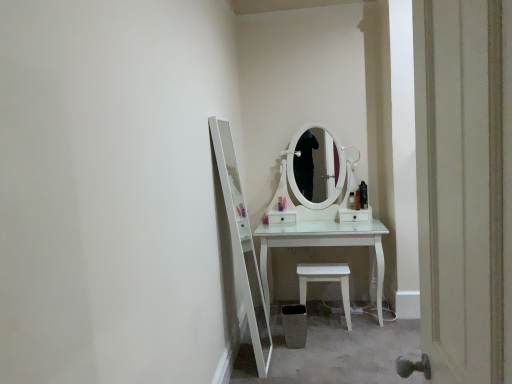
This screenshot has width=512, height=384. I want to click on translucent plastic bottle at center, the second toiletry from the left, so (284, 203).

What do you see at coordinates (326, 281) in the screenshot? This screenshot has width=512, height=384. I see `white plastic stool at lower center` at bounding box center [326, 281].

You are a GUI agent. You are given a task and a screenshot of the screen. Output one action in this format:
    pyautogui.click(x=<x>, y=<y>)
    Task: Click on the translucent plastic bottle at center, the second toiletry from the left
    Image resolution: width=512 pixels, height=384 pixels.
    Given the screenshot: What is the action you would take?
    pyautogui.click(x=284, y=203)

From a real-world perspective, is white wooden door at right above or below matte plastic container at center, placed as the 1th toiletry when sorted from left to right?

white wooden door at right is situated higher than matte plastic container at center, placed as the 1th toiletry when sorted from left to right, in the real world.

Is white wooden door at right not near matte plastic container at center, placed as the 1th toiletry when sorted from left to right?

white wooden door at right is positioned a significant distance from matte plastic container at center, placed as the 1th toiletry when sorted from left to right.

Considering the sizes of objects white wooden door at right and matte plastic container at center, placed as the 1th toiletry when sorted from left to right, in the image provided, who is shorter, white wooden door at right or matte plastic container at center, placed as the 1th toiletry when sorted from left to right,?

With less height is matte plastic container at center, placed as the 1th toiletry when sorted from left to right.

Considering the positions of objects matte black hairbrush at center, which is counted as the 3th toiletry, starting from the left, and translucent plastic bottle at center, the second toiletry from the left, in the image provided, who is behind, matte black hairbrush at center, which is counted as the 3th toiletry, starting from the left, or translucent plastic bottle at center, the second toiletry from the left,?

translucent plastic bottle at center, the second toiletry from the left, is further from the camera.

Between matte black hairbrush at center, positioned as the third toiletry in right-to-left order, and translucent plastic bottle at center, the second toiletry from the left, which one has larger width?

translucent plastic bottle at center, the second toiletry from the left, is wider.

How different are the orientations of matte black hairbrush at center, which is counted as the 3th toiletry, starting from the left, and translucent plastic bottle at center, which is counted as the 4th toiletry, starting from the right, in degrees?

matte black hairbrush at center, which is counted as the 3th toiletry, starting from the left, and translucent plastic bottle at center, which is counted as the 4th toiletry, starting from the right, are facing 0.00201 degrees away from each other.

Find the location of a particular element. This screenshot has height=384, width=512. toiletry that is the 1st one when counting backward from the matte black hairbrush at center, positioned as the third toiletry in right-to-left order is located at coordinates (284, 203).

You are a GUI agent. You are given a task and a screenshot of the screen. Output one action in this format:
    pyautogui.click(x=<x>, y=<y>)
    Task: Click on the toiletry that is the 2nd one when counting forward from the matte black hairbrush at center, positioned as the third toiletry in right-to-left order
    This screenshot has height=384, width=512.
    Given the screenshot: What is the action you would take?
    pyautogui.click(x=357, y=199)

Is matte black hairbrush at center, positioned as the third toiletry in right-to-left order, with matte orange bottle at center, the 2th toiletry viewed from the right?

Yes, matte black hairbrush at center, positioned as the third toiletry in right-to-left order, and matte orange bottle at center, the 2th toiletry viewed from the right, clearly make contact.

Is matte black hairbrush at center, positioned as the third toiletry in right-to-left order, oriented away from matte orange bottle at center, which is the 4th toiletry from left to right?

matte black hairbrush at center, positioned as the third toiletry in right-to-left order, does not have its back to matte orange bottle at center, which is the 4th toiletry from left to right.

Looking at this image, from their relative heights in the image, would you say matte black hairbrush at center, positioned as the third toiletry in right-to-left order, is taller or shorter than matte orange bottle at center, the 2th toiletry viewed from the right?

In the image, matte black hairbrush at center, positioned as the third toiletry in right-to-left order, appears to be shorter than matte orange bottle at center, the 2th toiletry viewed from the right.

Considering the positions of objects translucent plastic bottle at center, the second toiletry from the left, and white wooden door at right in the image provided, who is more to the right, translucent plastic bottle at center, the second toiletry from the left, or white wooden door at right?

white wooden door at right is more to the right.

How many degrees apart are the facing directions of translucent plastic bottle at center, the second toiletry from the left, and white wooden door at right?

The facing directions of translucent plastic bottle at center, the second toiletry from the left, and white wooden door at right are 90.9 degrees apart.

Who is smaller, translucent plastic bottle at center, the second toiletry from the left, or white wooden door at right?

translucent plastic bottle at center, the second toiletry from the left.

From a real-world perspective, does translucent plastic bottle at center, which is counted as the 4th toiletry, starting from the right, sit lower than matte black hairbrush at center, which is counted as the 3th toiletry, starting from the left?

Yes.

Is translucent plastic bottle at center, the second toiletry from the left, not near matte black hairbrush at center, which is counted as the 3th toiletry, starting from the left?

No.

Considering the sizes of objects translucent plastic bottle at center, the second toiletry from the left, and matte black hairbrush at center, positioned as the third toiletry in right-to-left order, in the image provided, who is thinner, translucent plastic bottle at center, the second toiletry from the left, or matte black hairbrush at center, positioned as the third toiletry in right-to-left order,?

matte black hairbrush at center, positioned as the third toiletry in right-to-left order.

Does translucent plastic bottle at center, the second toiletry from the left, come in front of matte black hairbrush at center, which is counted as the 3th toiletry, starting from the left?

That is False.

Where is `the 1st toiletry counting from the right side of the white wooden door at right`? This screenshot has width=512, height=384. the 1st toiletry counting from the right side of the white wooden door at right is located at coordinates (352, 201).

Consider the image. Would you consider white wooden door at right to be distant from matte black hairbrush at center, positioned as the third toiletry in right-to-left order?

That's right, there is a large distance between white wooden door at right and matte black hairbrush at center, positioned as the third toiletry in right-to-left order.

Based on the photo, does white wooden door at right appear on the left side of matte black hairbrush at center, positioned as the third toiletry in right-to-left order?

Indeed, white wooden door at right is positioned on the left side of matte black hairbrush at center, positioned as the third toiletry in right-to-left order.

Is matte orange bottle at center, the 2th toiletry viewed from the right, directly adjacent to translucent plastic spray bottle at right, positioned as the first toiletry in right-to-left order?

Yes, matte orange bottle at center, the 2th toiletry viewed from the right, and translucent plastic spray bottle at right, positioned as the first toiletry in right-to-left order, clearly make contact.

Relative to translucent plastic spray bottle at right, acting as the fifth toiletry starting from the left, is matte orange bottle at center, which is the 4th toiletry from left to right, in front or behind?

In the image, matte orange bottle at center, which is the 4th toiletry from left to right, appears in front of translucent plastic spray bottle at right, acting as the fifth toiletry starting from the left.

From the image's perspective, is matte orange bottle at center, the 2th toiletry viewed from the right, over translucent plastic spray bottle at right, positioned as the first toiletry in right-to-left order?

No, from the image's perspective, matte orange bottle at center, the 2th toiletry viewed from the right, is not on top of translucent plastic spray bottle at right, positioned as the first toiletry in right-to-left order.

Does point (357, 200) come behind point (366, 187)?

No, (357, 200) is in front of (366, 187).

You are a GUI agent. You are given a task and a screenshot of the screen. Output one action in this format:
    pyautogui.click(x=<x>, y=<y>)
    Task: Click on the door in front of the matte plastic container at center, which ranks as the 5th toiletry in right-to-left order
    The height and width of the screenshot is (384, 512).
    Given the screenshot: What is the action you would take?
    pyautogui.click(x=460, y=186)

Identify the location of the 1st toiletry to the right when counting from the translucent plastic bottle at center, which is counted as the 4th toiletry, starting from the right. This screenshot has width=512, height=384. (352, 201).

Considering their positions, is white plastic stool at lower center positioned further to matte plastic container at center, placed as the 1th toiletry when sorted from left to right, than matte orange bottle at center, which is the 4th toiletry from left to right?

Among the two, white plastic stool at lower center is located further to matte plastic container at center, placed as the 1th toiletry when sorted from left to right.

From the image, which object appears to be farther from translucent plastic spray bottle at right, positioned as the first toiletry in right-to-left order, matte black hairbrush at center, positioned as the third toiletry in right-to-left order, or matte plastic container at center, which ranks as the 5th toiletry in right-to-left order?

The object further to translucent plastic spray bottle at right, positioned as the first toiletry in right-to-left order, is matte plastic container at center, which ranks as the 5th toiletry in right-to-left order.

Looking at the image, which one is located further to white wooden door at right, translucent plastic bottle at center, which is counted as the 4th toiletry, starting from the right, or matte plastic container at center, which ranks as the 5th toiletry in right-to-left order?

Based on the image, translucent plastic bottle at center, which is counted as the 4th toiletry, starting from the right, appears to be further to white wooden door at right.

From the image, which object appears to be nearer to matte plastic container at center, placed as the 1th toiletry when sorted from left to right, white wooden door at right or matte black hairbrush at center, positioned as the third toiletry in right-to-left order?

matte black hairbrush at center, positioned as the third toiletry in right-to-left order, is positioned closer to the anchor matte plastic container at center, placed as the 1th toiletry when sorted from left to right.

Consider the image. Based on their spatial positions, is matte orange bottle at center, which is the 4th toiletry from left to right, or white plastic stool at lower center closer to translucent plastic spray bottle at right, positioned as the first toiletry in right-to-left order?

matte orange bottle at center, which is the 4th toiletry from left to right.

Which object lies nearer to the anchor point white wooden door at right, matte orange bottle at center, the 2th toiletry viewed from the right, or white plastic stool at lower center?

white plastic stool at lower center.

When comparing their distances from translucent plastic spray bottle at right, acting as the fifth toiletry starting from the left, does matte orange bottle at center, which is the 4th toiletry from left to right, or white wooden door at right seem closer?

The object closer to translucent plastic spray bottle at right, acting as the fifth toiletry starting from the left, is matte orange bottle at center, which is the 4th toiletry from left to right.

Estimate the real-world distances between objects in this image. Which object is further from white wooden door at right, matte orange bottle at center, which is the 4th toiletry from left to right, or matte plastic container at center, placed as the 1th toiletry when sorted from left to right?

The object further to white wooden door at right is matte plastic container at center, placed as the 1th toiletry when sorted from left to right.

Locate an element on the screen. The width and height of the screenshot is (512, 384). stool between white wooden door at right and matte plastic container at center, which ranks as the 5th toiletry in right-to-left order, along the z-axis is located at coordinates (326, 281).

Where is `toiletry between matte plastic container at center, placed as the 1th toiletry when sorted from left to right, and matte black hairbrush at center, positioned as the third toiletry in right-to-left order, in the horizontal direction`? The width and height of the screenshot is (512, 384). toiletry between matte plastic container at center, placed as the 1th toiletry when sorted from left to right, and matte black hairbrush at center, positioned as the third toiletry in right-to-left order, in the horizontal direction is located at coordinates (284, 203).

Identify the location of toiletry that lies between matte plastic container at center, placed as the 1th toiletry when sorted from left to right, and white plastic stool at lower center from top to bottom. Image resolution: width=512 pixels, height=384 pixels. (284, 203).

The image size is (512, 384). I want to click on toiletry situated between translucent plastic bottle at center, which is counted as the 4th toiletry, starting from the right, and matte orange bottle at center, which is the 4th toiletry from left to right, from left to right, so click(352, 201).